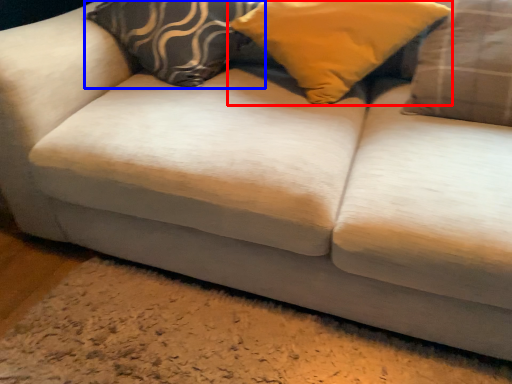
Question: Which object appears closest to the camera in this image, pillow (highlighted by a red box) or pillow (highlighted by a blue box)?

Choices:
 (A) pillow
 (B) pillow

Answer: (A)